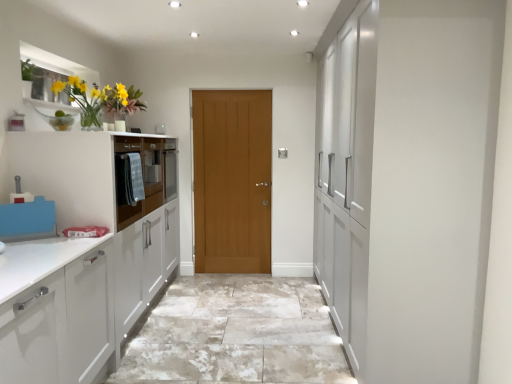
Question: Is matte glass vase at upper left aimed at matte gray oven at left?

Choices:
 (A) no
 (B) yes

Answer: (A)

Question: Is matte glass vase at upper left positioned in front of matte gray oven at left?

Choices:
 (A) yes
 (B) no

Answer: (A)

Question: Can you confirm if matte glass vase at upper left is wider than matte gray oven at left?

Choices:
 (A) no
 (B) yes

Answer: (A)

Question: Can you confirm if matte glass vase at upper left is thinner than matte gray oven at left?

Choices:
 (A) no
 (B) yes

Answer: (B)

Question: Considering the relative sizes of matte glass vase at upper left and matte gray oven at left in the image provided, is matte glass vase at upper left shorter than matte gray oven at left?

Choices:
 (A) yes
 (B) no

Answer: (A)

Question: Would you say matte glass vase at upper left is to the left or to the right of matte gray oven at left in the picture?

Choices:
 (A) left
 (B) right

Answer: (B)

Question: From the image's perspective, relative to matte gray oven at left, is matte glass vase at upper left above or below?

Choices:
 (A) below
 (B) above

Answer: (B)

Question: From a real-world perspective, is matte glass vase at upper left positioned above or below matte gray oven at left?

Choices:
 (A) below
 (B) above

Answer: (B)

Question: Relative to matte gray oven at left, is matte glass vase at upper left in front or behind?

Choices:
 (A) front
 (B) behind

Answer: (A)

Question: Looking at the image, does light brown wooden door at center seem bigger or smaller compared to matte glass vase at upper left?

Choices:
 (A) big
 (B) small

Answer: (A)

Question: Relative to matte glass vase at upper left, is light brown wooden door at center in front or behind?

Choices:
 (A) behind
 (B) front

Answer: (A)

Question: In the image, is light brown wooden door at center on the left side or the right side of matte glass vase at upper left?

Choices:
 (A) right
 (B) left

Answer: (A)

Question: Considering the positions of point pos(230,226) and point pos(82,97), is point pos(230,226) closer or farther from the camera than point pos(82,97)?

Choices:
 (A) closer
 (B) farther

Answer: (B)

Question: Considering the positions of natural stone floor at center and light brown wooden door at center in the image, is natural stone floor at center bigger or smaller than light brown wooden door at center?

Choices:
 (A) small
 (B) big

Answer: (B)

Question: In the image, is natural stone floor at center positioned in front of or behind light brown wooden door at center?

Choices:
 (A) behind
 (B) front

Answer: (B)